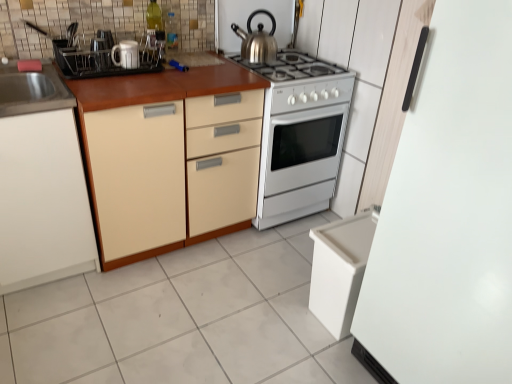
Question: Is white plastic dishwasher at lower right wider or thinner than white glossy mug at upper left, the 2th appliance viewed from the left?

Choices:
 (A) thin
 (B) wide

Answer: (B)

Question: From their relative heights in the image, would you say white plastic dishwasher at lower right is taller or shorter than white glossy mug at upper left, which is the 3th appliance in front-to-back order?

Choices:
 (A) short
 (B) tall

Answer: (B)

Question: Estimate the real-world distances between objects in this image. Which object is farther from the polished stainless steel kettle at upper center?

Choices:
 (A) white glossy refrigerator at right, which ranks as the fourth appliance in left-to-right order
 (B) matte white mug at upper left, acting as the fourth appliance starting from the right
 (C) white plastic dishwasher at lower right
 (D) white glossy mug at upper left, the 2th appliance viewed from the left
 (E) transparent plastic bottle at upper center

Answer: (A)

Question: Which of these objects is positioned farthest from the white glossy tile at lower center?

Choices:
 (A) white glossy gas stove at center
 (B) white glossy oven at center, which ranks as the 4th appliance in front-to-back order
 (C) transparent plastic bottle at upper center
 (D) matte cream cabinet at center, the 1th cabinetry positioned from the right
 (E) stainless steel sink at left

Answer: (C)